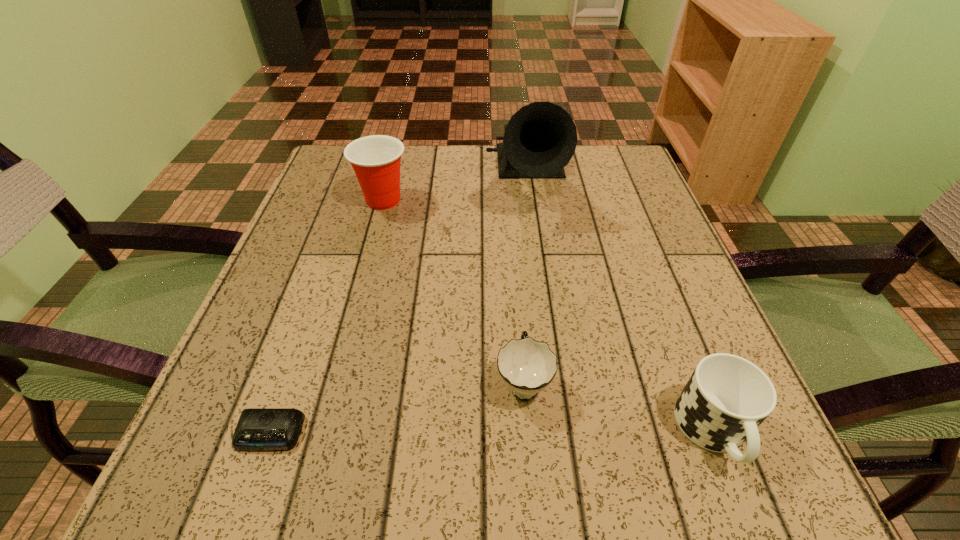
Locate an element on the screen. The height and width of the screenshot is (540, 960). free space between the second cup from left to right and the second tallest object is located at coordinates (453, 291).

Where is `vacant area between the rightmost object and the phonograph_record`? The image size is (960, 540). vacant area between the rightmost object and the phonograph_record is located at coordinates (620, 306).

Identify the location of vacant space that is in between the tallest cup and the fourth tallest object. Image resolution: width=960 pixels, height=540 pixels. (453, 291).

Identify the location of free space between the fourth shortest object and the shortest object. (326, 317).

Where is `free space between the tallest object and the alarm clock`? free space between the tallest object and the alarm clock is located at coordinates (398, 307).

Locate an element on the screen. vacant area that lies between the tallest cup and the second cup from left to right is located at coordinates (453, 291).

In order to click on vacant space that is in between the farthest cup and the shortest object in this screenshot , I will do `click(326, 317)`.

Where is `vacant area between the tallest object and the second cup from right to left`? The width and height of the screenshot is (960, 540). vacant area between the tallest object and the second cup from right to left is located at coordinates (525, 281).

Locate an element on the screen. Image resolution: width=960 pixels, height=540 pixels. object identified as the second closest to the tallest cup is located at coordinates (526, 366).

The image size is (960, 540). I want to click on object that stands as the closest to the tallest object, so click(x=376, y=159).